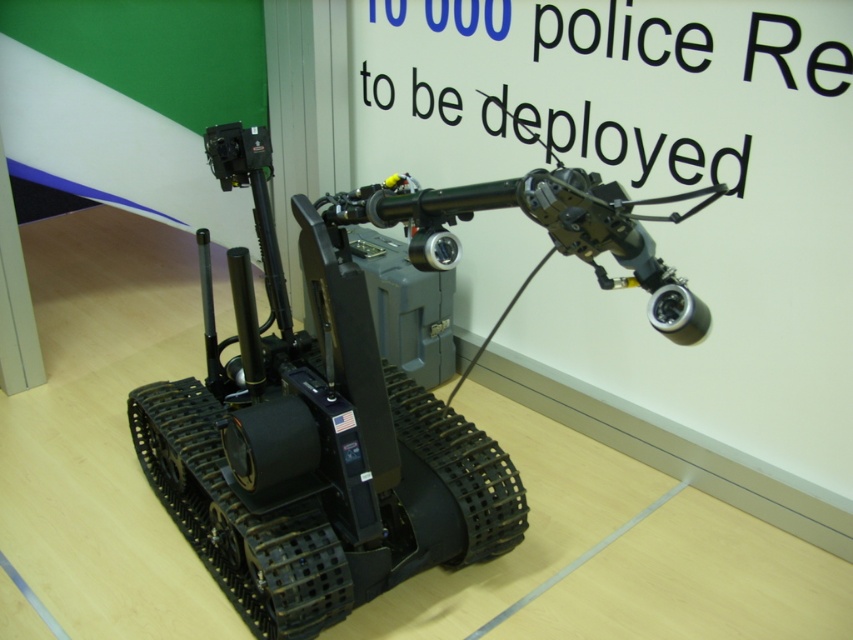
You are standing in front of the robotic device and want to determine which of the two points, point (250,333) or point (589,131), is nearer to you. Based on the image provided, which point is closer?

Point (250,333) is closer to the camera than point (589,131), so the point closer to you is point (250,333).